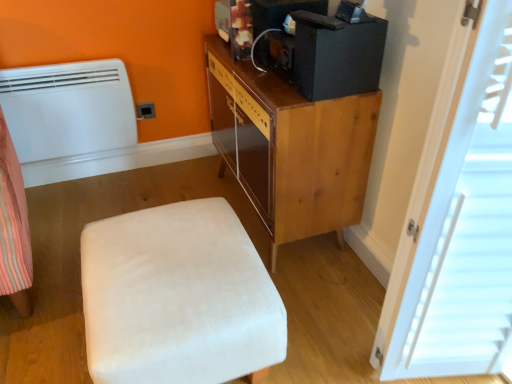
Locate an element on the screen. The image size is (512, 384). vacant area situated below black matte desktop computer at upper right (from a real-world perspective) is located at coordinates [345, 90].